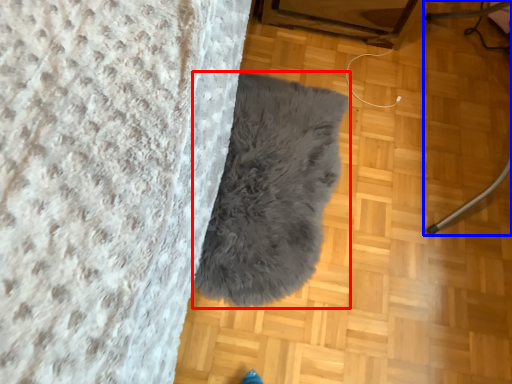
Question: Among these objects, which one is nearest to the camera, blanket (highlighted by a red box) or furniture (highlighted by a blue box)?

Choices:
 (A) blanket
 (B) furniture

Answer: (B)